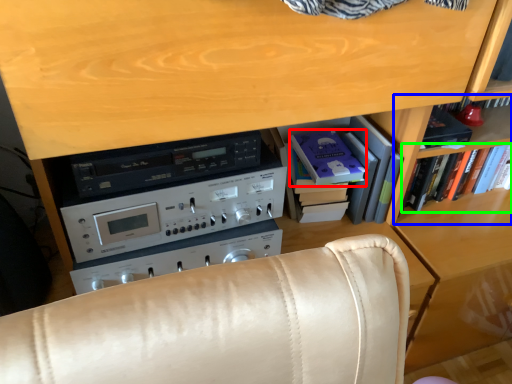
Question: Which is nearer to the paperback book (highlighted by a red box)? shelf (highlighted by a blue box) or book (highlighted by a green box).

Choices:
 (A) shelf
 (B) book

Answer: (A)